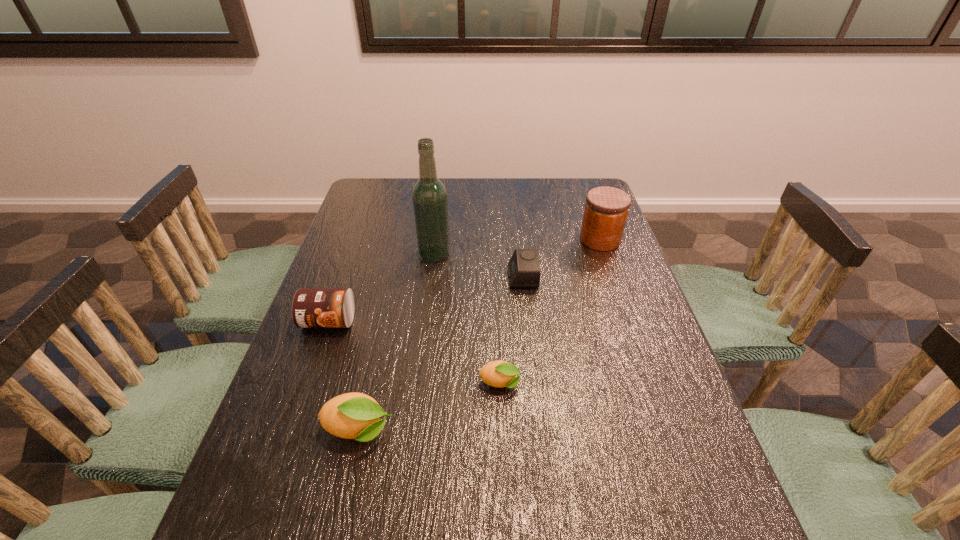
The height and width of the screenshot is (540, 960). Identify the location of vacant region located 0.060m with leaves positioned above the taller lemon. (423, 430).

Locate an element on the screen. The width and height of the screenshot is (960, 540). vacant space situated with leaves positioned above the shorter lemon is located at coordinates (616, 384).

Identify the location of vacant space located 0.110m on the left of the tallest object. The height and width of the screenshot is (540, 960). (383, 254).

Locate an element on the screen. vacant space located on the left of the rightmost object is located at coordinates (539, 239).

At what (x,y) coordinates should I click in order to perform the action: click on vacant space situated on the front label of the leftmost object. Please return your answer as a coordinate pair (x, y). Looking at the image, I should click on (x=312, y=368).

Image resolution: width=960 pixels, height=540 pixels. In order to click on blank space located 0.130m on the front-facing side of the fourth nearest object in this screenshot , I will do `click(463, 277)`.

Where is `vacant space situated on the front-facing side of the fourth nearest object`? Image resolution: width=960 pixels, height=540 pixels. vacant space situated on the front-facing side of the fourth nearest object is located at coordinates click(x=400, y=277).

Find the location of a particular element. Image resolution: width=960 pixels, height=540 pixels. free space located on the front-facing side of the fourth nearest object is located at coordinates (452, 277).

You are a GUI agent. You are given a task and a screenshot of the screen. Output one action in this format:
    pyautogui.click(x=<x>, y=<y>)
    Task: Click on the lemon positioned at the left edge
    The height and width of the screenshot is (540, 960).
    Given the screenshot: What is the action you would take?
    pyautogui.click(x=357, y=416)

Locate an element on the screen. The width and height of the screenshot is (960, 540). can present at the left edge is located at coordinates coord(312,307).